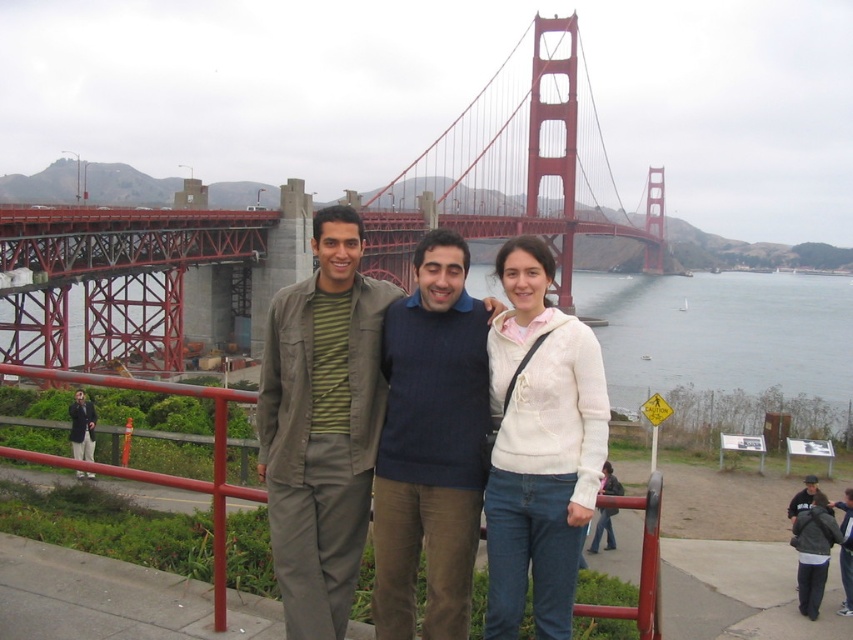
Can you confirm if red steel bridge at center is wider than dark blue sweater at center?

Yes.

Between red steel bridge at center and dark blue sweater at center, which one appears on the left side from the viewer's perspective?

Positioned to the left is red steel bridge at center.

Who is more distant from viewer, (425, 177) or (456, 284)?

The point (425, 177) is more distant.

I want to click on red steel bridge at center, so click(x=515, y=166).

Which of these two, green striped shirt at center or red metal railing at center, stands taller?

green striped shirt at center

Can you confirm if green striped shirt at center is taller than red metal railing at center?

Yes, green striped shirt at center is taller than red metal railing at center.

Is point (300, 333) less distant than point (96, 380)?

No, (300, 333) is behind (96, 380).

Locate an element on the screen. The image size is (853, 640). green striped shirt at center is located at coordinates (321, 426).

Is green striped shirt at center to the right of dark blue sweater at center from the viewer's perspective?

Incorrect, green striped shirt at center is not on the right side of dark blue sweater at center.

Between point (364, 339) and point (466, 260), which one is positioned behind?

Positioned behind is point (466, 260).

Locate an element on the screen. green striped shirt at center is located at coordinates (321, 426).